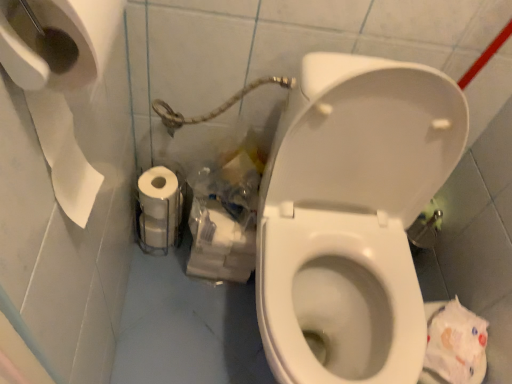
Question: From the image's perspective, is white matte toilet paper at lower left positioned above or below translucent plastic bag at lower center?

Choices:
 (A) below
 (B) above

Answer: (B)

Question: In terms of height, does white matte toilet paper at lower left look taller or shorter compared to translucent plastic bag at lower center?

Choices:
 (A) short
 (B) tall

Answer: (A)

Question: Estimate the real-world distances between objects in this image. Which object is farther from the white matte toilet paper at lower left?

Choices:
 (A) white glossy toilet at center
 (B) translucent plastic bag at lower center

Answer: (A)

Question: Which is nearer to the white matte toilet paper at lower left?

Choices:
 (A) white glossy toilet at center
 (B) translucent plastic bag at lower center

Answer: (B)